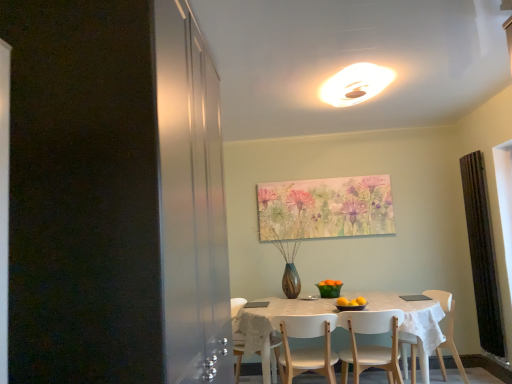
You are a GUI agent. You are given a task and a screenshot of the screen. Output one action in this format:
    pyautogui.click(x=<x>, y=<y>)
    Task: Click on the free spot above watercolor canvas at upper center (from a real-world perspective)
    The width and height of the screenshot is (512, 384).
    Given the screenshot: What is the action you would take?
    pyautogui.click(x=322, y=175)